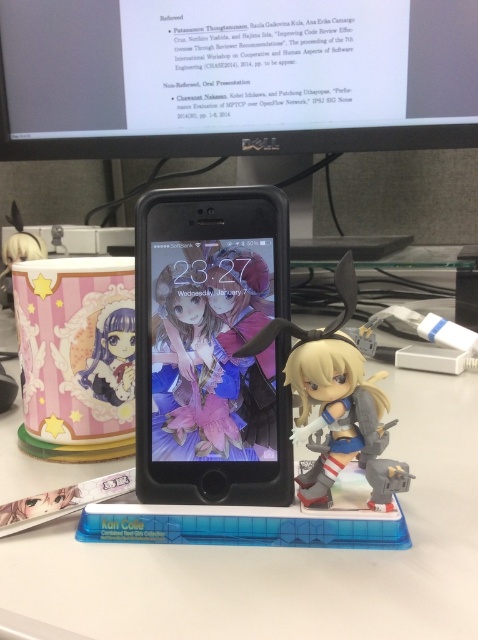
Question: Which point appears farthest from the camera in this image?

Choices:
 (A) (112, 312)
 (B) (213, 280)
 (C) (259, 28)

Answer: (C)

Question: Among these points, which one is nearest to the camera?

Choices:
 (A) (273, 20)
 (B) (162, 419)
 (C) (109, 380)

Answer: (B)

Question: Which point is closer to the camera?

Choices:
 (A) black matte phone at center
 (B) matte plastic figurine at left
 (C) black matte computer monitor at upper center

Answer: (A)

Question: Can you confirm if black matte phone at center is smaller than matte plastic figurine at left?

Choices:
 (A) yes
 (B) no

Answer: (B)

Question: Does black matte computer monitor at upper center have a greater width compared to black matte phone at center?

Choices:
 (A) yes
 (B) no

Answer: (A)

Question: Is black matte computer monitor at upper center further to camera compared to black matte phone at center?

Choices:
 (A) yes
 (B) no

Answer: (A)